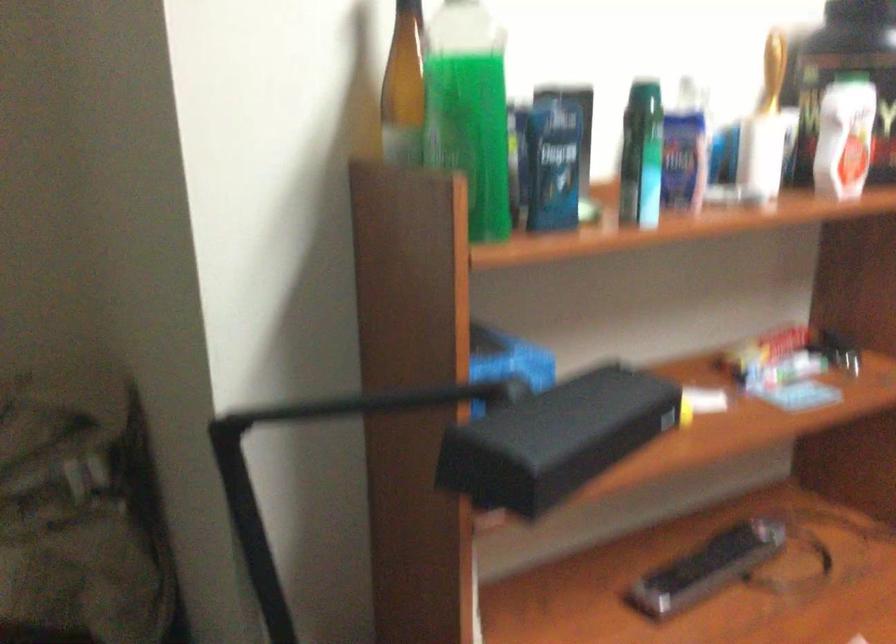
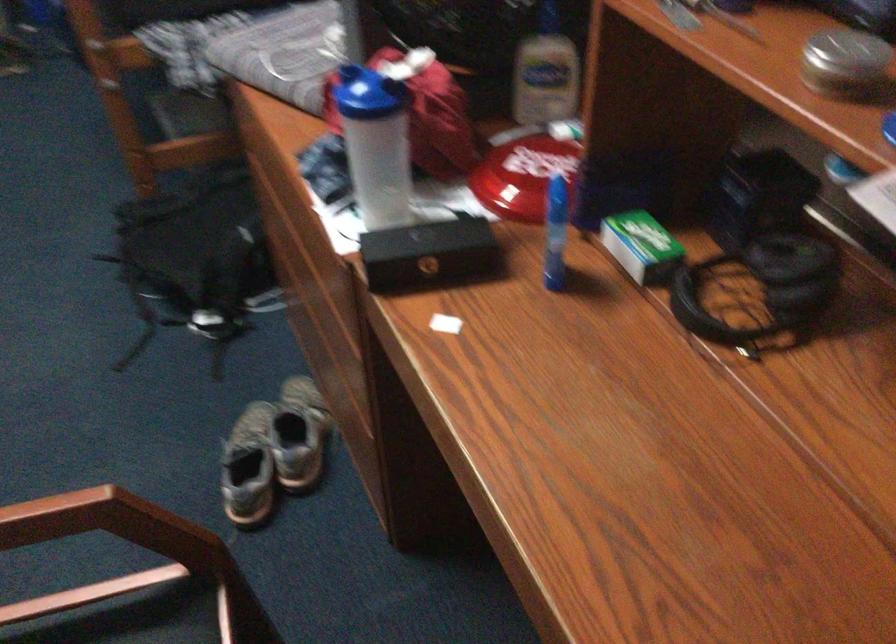
First-person continuous shooting, in which direction is the camera rotating?

The camera rotated toward right-down.